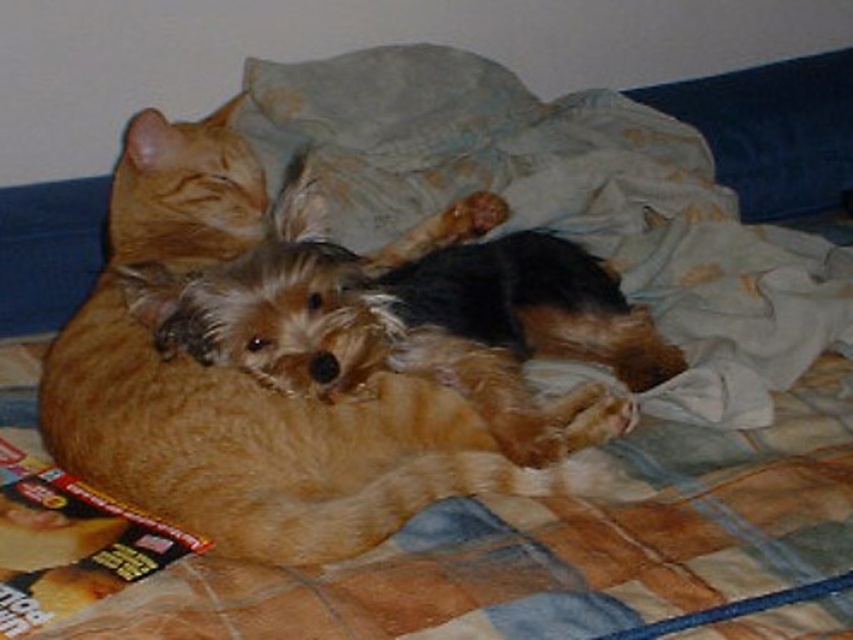
You are taking a photo of the cat and the dog resting on the bed. You want to focus on the point closer to the camera. Which point should you choose between point [723,163] and point [169,545]?

Point [723,163] is further to the camera than point [169,545], so you should choose point [723,163] to focus on the closer point.

You are standing at the foot of the bed and looking towards the headboard. Which of the two points, point (351, 257) or point (691, 106), is closer to you?

Point (691, 106) is closer to you because it is behind point (351, 257), so from your perspective at the foot of the bed, point (691, 106) would be nearer.